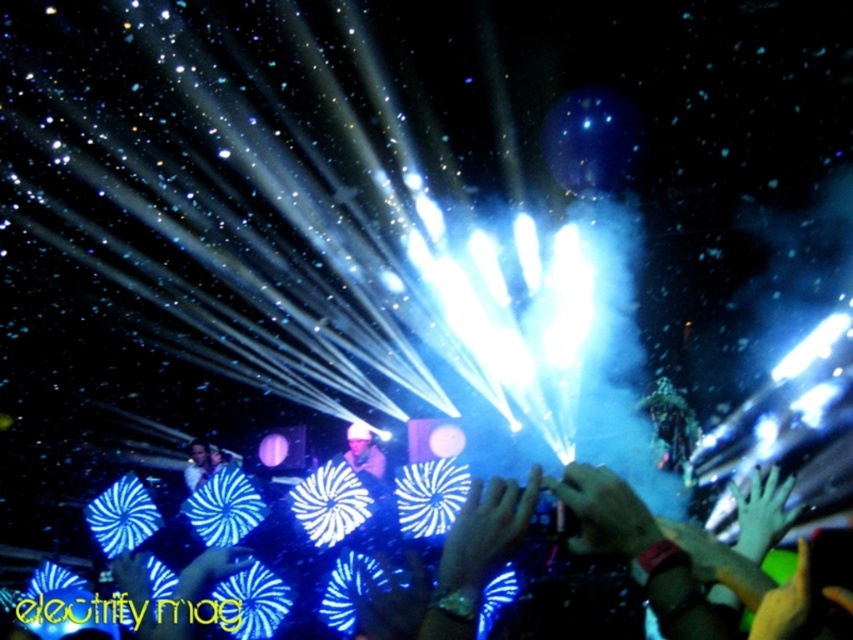
Consider the image. Who is lower down, blue fabric fan at center or matte black camera at center?

Positioned lower is matte black camera at center.

Can you confirm if blue fabric fan at center is taller than matte black camera at center?

Correct, blue fabric fan at center is much taller as matte black camera at center.

Who is more distant from viewer, (x=602, y=477) or (x=354, y=440)?

The point (x=354, y=440) is behind.

You are a GUI agent. You are given a task and a screenshot of the screen. Output one action in this format:
    pyautogui.click(x=<x>, y=<y>)
    Task: Click on the blue fabric fan at center
    This screenshot has width=853, height=640.
    Given the screenshot: What is the action you would take?
    pyautogui.click(x=479, y=550)